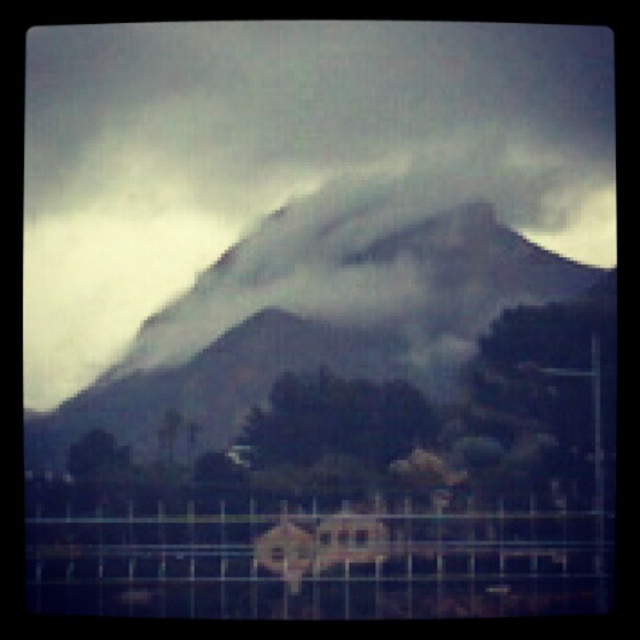
Does foggy gray mountain at center have a smaller size compared to metallic wire fence at lower center?

Actually, foggy gray mountain at center might be larger than metallic wire fence at lower center.

Between point (372, 237) and point (608, 566), which one is positioned in front?

Point (608, 566) is more forward.

The width and height of the screenshot is (640, 640). Identify the location of foggy gray mountain at center. (317, 312).